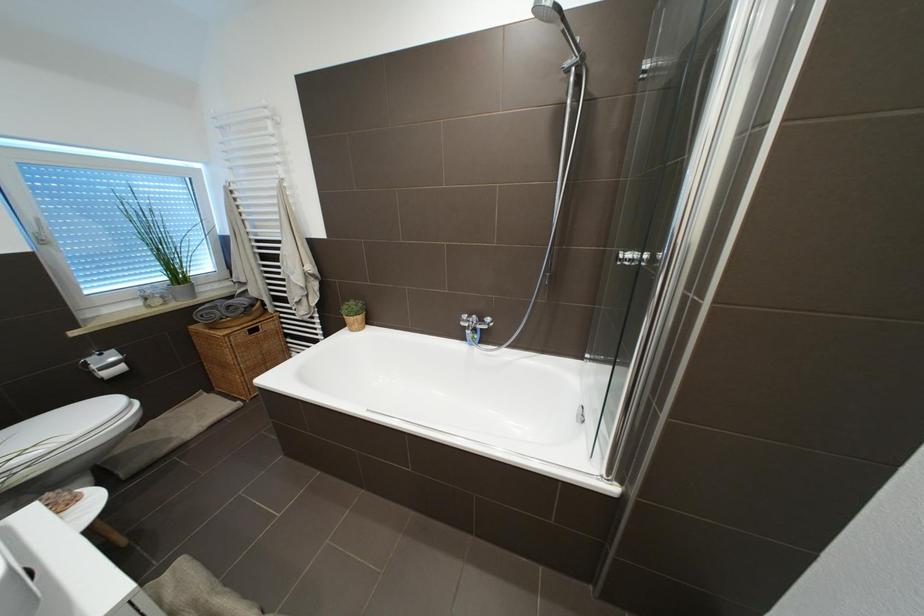
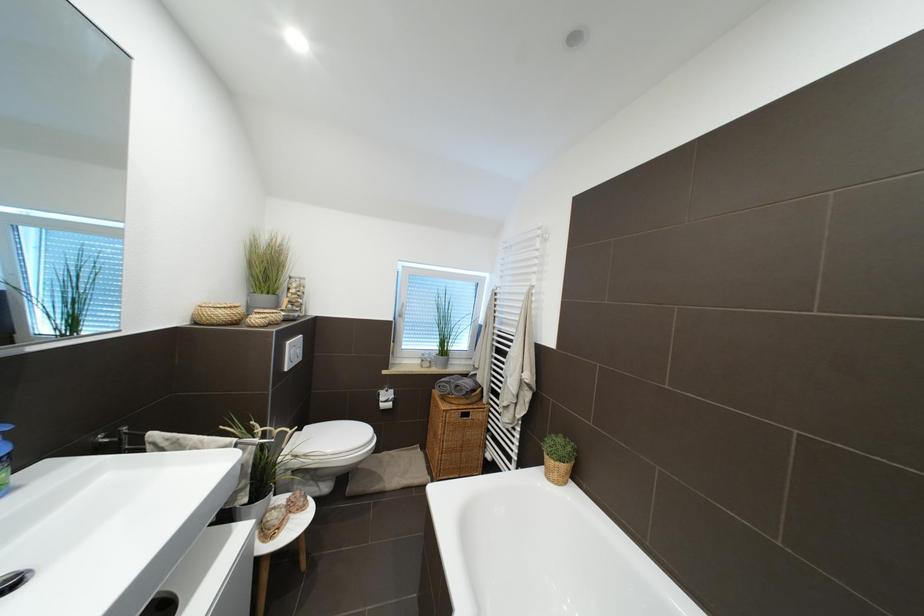
Question: The camera is either moving clockwise (left) or counter-clockwise (right) around the object. The first image is from the beginning of the video and the second image is from the end. Is the camera moving left or right when shooting the video?

Choices:
 (A) Left
 (B) Right

Answer: (B)